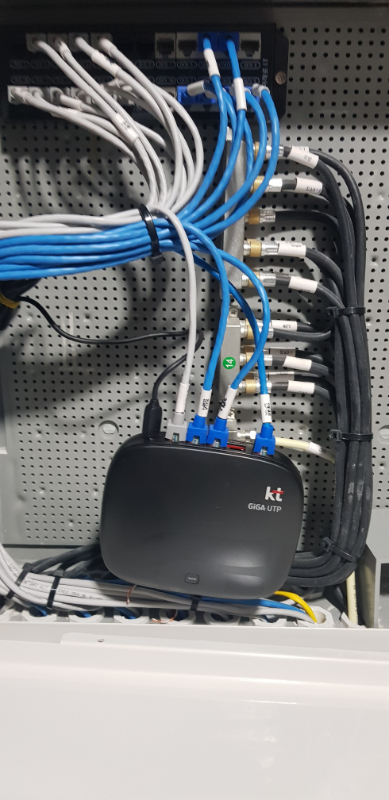
Locate an element on the screen. The height and width of the screenshot is (800, 389). blue wires in a connection box is located at coordinates (223, 122), (228, 105), (238, 121), (244, 130), (258, 116), (273, 110), (211, 361), (243, 370), (261, 377).